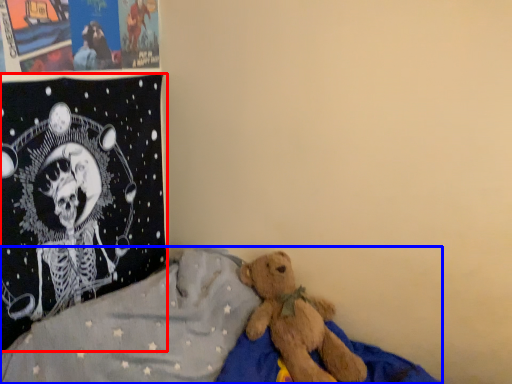
Question: Which of the following is the closest to the observer, pillow (highlighted by a red box) or bed (highlighted by a blue box)?

Choices:
 (A) pillow
 (B) bed

Answer: (B)